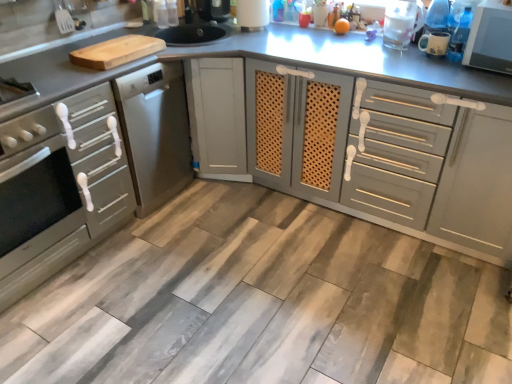
You are a GUI agent. You are given a task and a screenshot of the screen. Output one action in this format:
    pyautogui.click(x=<x>, y=<y>)
    Task: Click on the vacant space to the right of white textured paper towel holder at upper center, placed as the 1th appliance when sorted from back to front
    The image size is (512, 384).
    Given the screenshot: What is the action you would take?
    pyautogui.click(x=285, y=31)